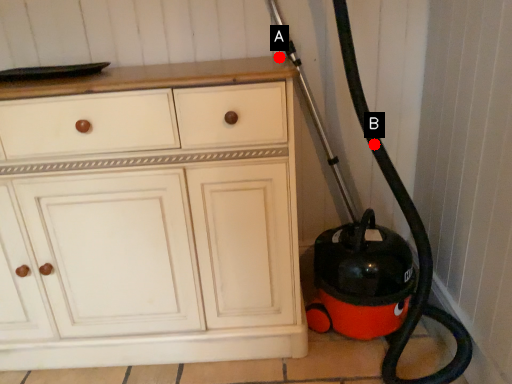
Question: Two points are circled on the image, labeled by A and B beside each circle. Which of the following is the farthest from the observer?

Choices:
 (A) A is further
 (B) B is further

Answer: (A)